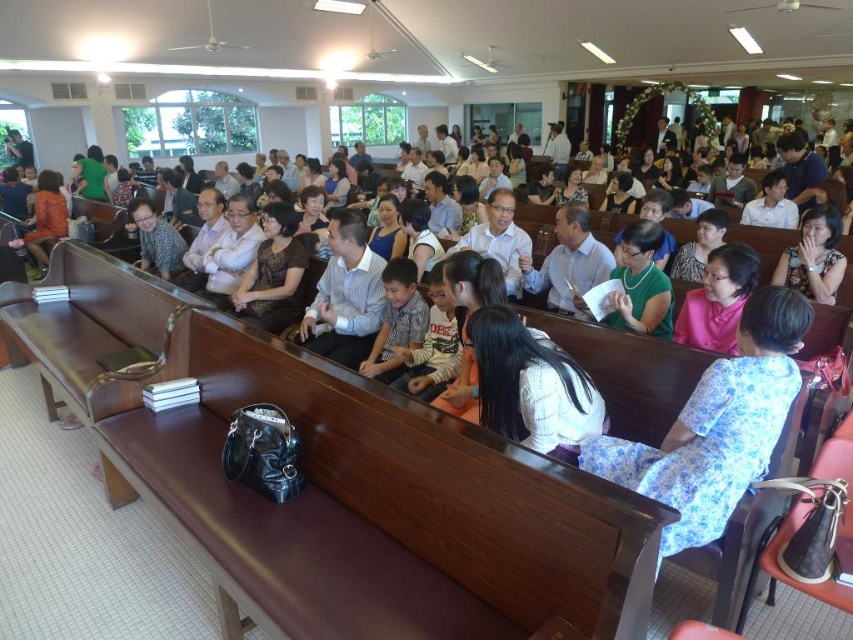
Between blue floral dress at center and matte black jacket at center, which one has less height?

blue floral dress at center is shorter.

Can you confirm if blue floral dress at center is smaller than matte black jacket at center?

Correct, blue floral dress at center occupies less space than matte black jacket at center.

The width and height of the screenshot is (853, 640). Identify the location of blue floral dress at center. (717, 426).

Is white sweater at center to the left of matte black jacket at center from the viewer's perspective?

Incorrect, white sweater at center is not on the left side of matte black jacket at center.

The image size is (853, 640). What do you see at coordinates (531, 385) in the screenshot? I see `white sweater at center` at bounding box center [531, 385].

Who is more forward, (488, 403) or (44, 216)?

Point (488, 403)

You are a GUI agent. You are given a task and a screenshot of the screen. Output one action in this format:
    pyautogui.click(x=<x>, y=<y>)
    Task: Click on the white sweater at center
    
    Given the screenshot: What is the action you would take?
    pyautogui.click(x=531, y=385)

Which is below, white sweater at center or matte green dress at center?

Positioned lower is white sweater at center.

Who is positioned more to the right, white sweater at center or matte green dress at center?

Positioned to the right is matte green dress at center.

Is point (502, 417) closer to viewer compared to point (801, 221)?

Yes, it is.

Where is `white sweater at center`? white sweater at center is located at coordinates (531, 385).